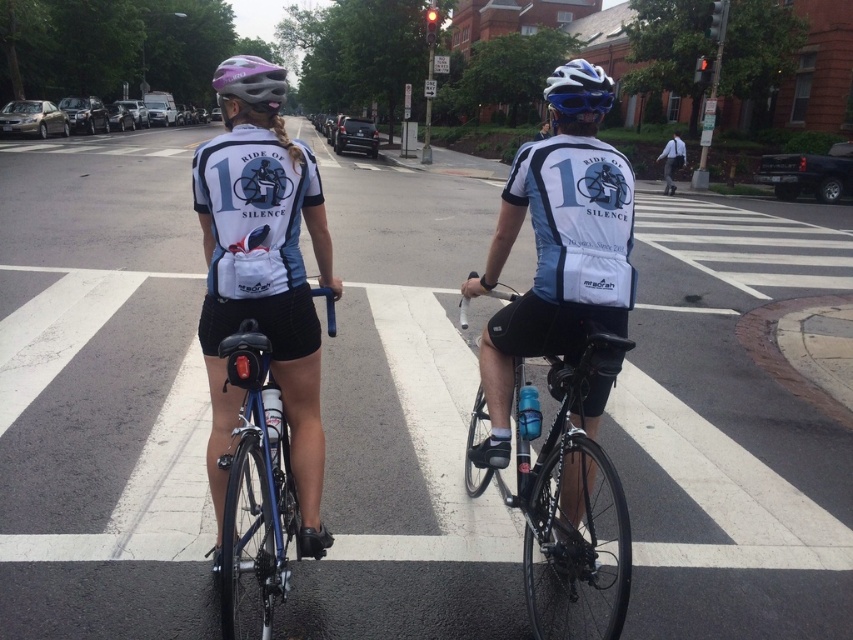
Question: Is shiny black frame at center closer to camera compared to gray fabric backpack at upper right?

Choices:
 (A) yes
 (B) no

Answer: (A)

Question: Which is farther from the gray fabric backpack at upper right?

Choices:
 (A) blue metallic bicycle at center
 (B) matte blue helmet at upper center
 (C) purple matte bicycle helmet at upper center

Answer: (A)

Question: Is blue metallic bicycle at center closer to camera compared to matte blue helmet at upper center?

Choices:
 (A) no
 (B) yes

Answer: (B)

Question: Which of the following is the farthest from the observer?

Choices:
 (A) (548, 611)
 (B) (663, 168)
 (C) (213, 80)

Answer: (C)

Question: Does matte blue helmet at upper center appear on the right side of purple matte bicycle helmet at upper center?

Choices:
 (A) yes
 (B) no

Answer: (A)

Question: Which object is farther from the camera taking this photo?

Choices:
 (A) shiny black frame at center
 (B) matte blue helmet at upper center

Answer: (B)